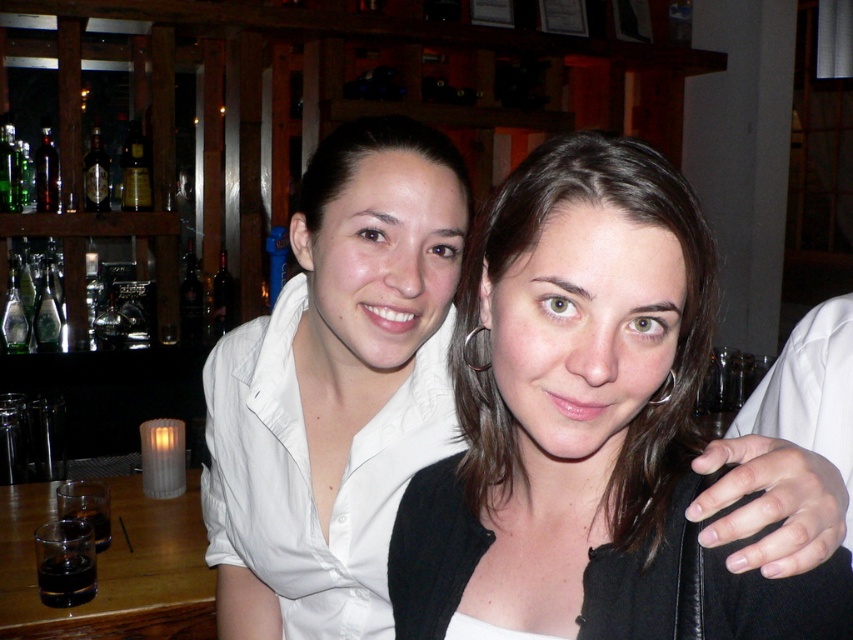
The image size is (853, 640). What do you see at coordinates (585, 422) in the screenshot?
I see `matte black jacket at center` at bounding box center [585, 422].

How distant is matte black jacket at center from dark amber glass bottle at upper left?

matte black jacket at center is 6.57 feet from dark amber glass bottle at upper left.

Who is more distant from viewer, (653, 196) or (97, 209)?

Point (97, 209)

In order to click on matte black jacket at center in this screenshot , I will do `click(585, 422)`.

Does white matte shirt at center have a greater width compared to shiny gold bottle at upper left?

Indeed, white matte shirt at center has a greater width compared to shiny gold bottle at upper left.

Is point (281, 611) positioned after point (143, 140)?

No, it is in front of (143, 140).

The width and height of the screenshot is (853, 640). In order to click on white matte shirt at center in this screenshot , I will do `click(335, 388)`.

Does shiny gold bottle at upper left have a smaller size compared to dark amber glass bottle at upper left?

Indeed, shiny gold bottle at upper left has a smaller size compared to dark amber glass bottle at upper left.

Does shiny gold bottle at upper left come in front of dark amber glass bottle at upper left?

That is False.

What do you see at coordinates (135, 170) in the screenshot? I see `shiny gold bottle at upper left` at bounding box center [135, 170].

The width and height of the screenshot is (853, 640). I want to click on shiny gold bottle at upper left, so click(x=135, y=170).